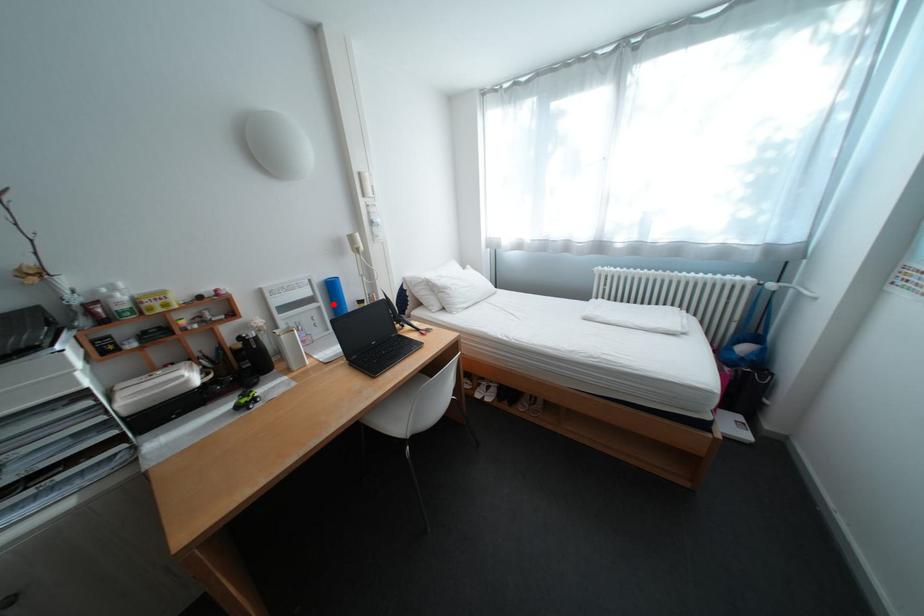
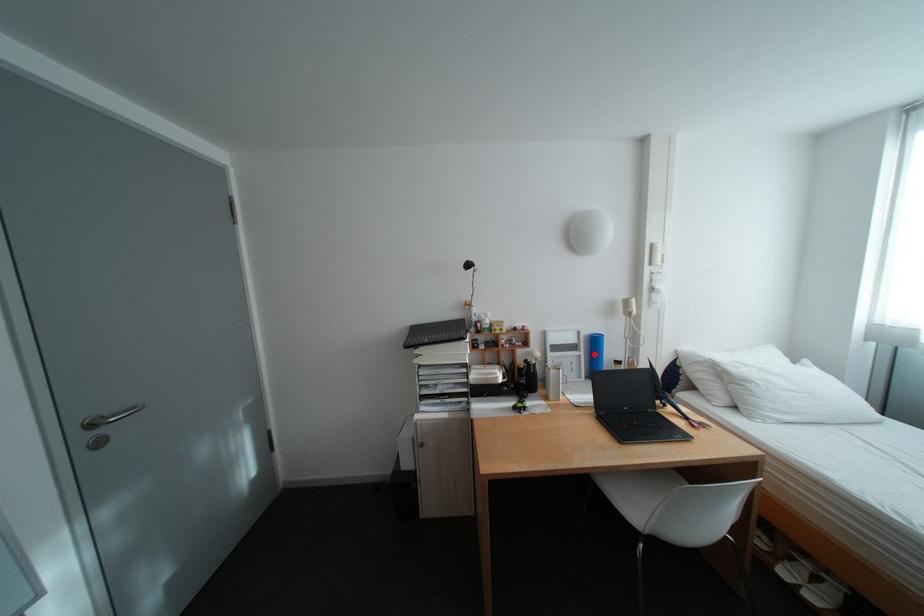
I am providing you with two images of the same scene from different viewpoints. A red point is marked on the first image and another point is marked on the second image. Does the point marked in image1 correspond to the same location as the one in image2?

Yes